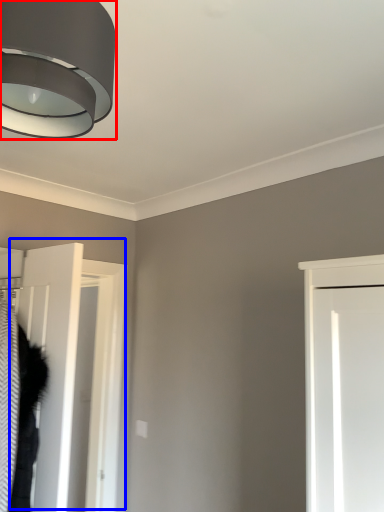
Question: Which point is further to the camera, lamp (highlighted by a red box) or door (highlighted by a blue box)?

Choices:
 (A) lamp
 (B) door

Answer: (B)